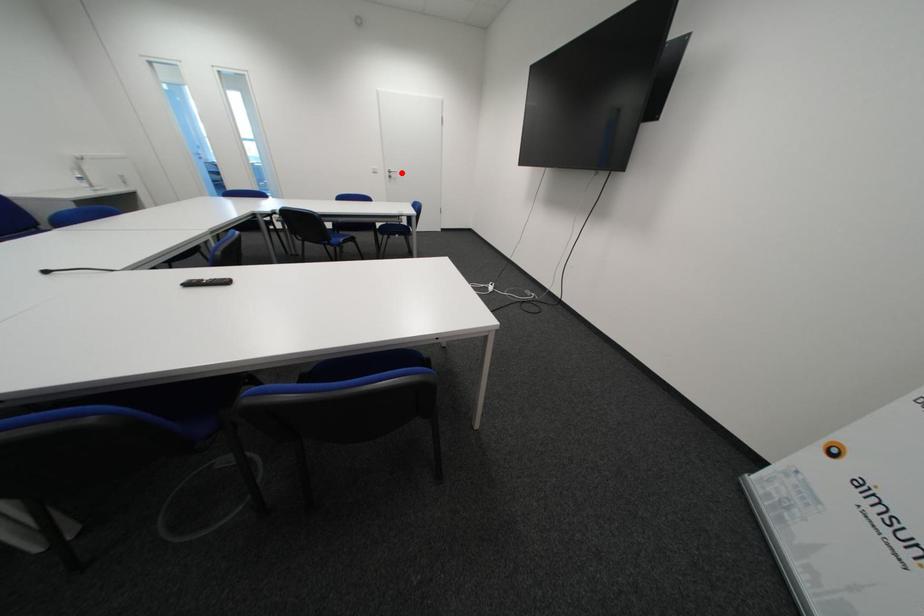
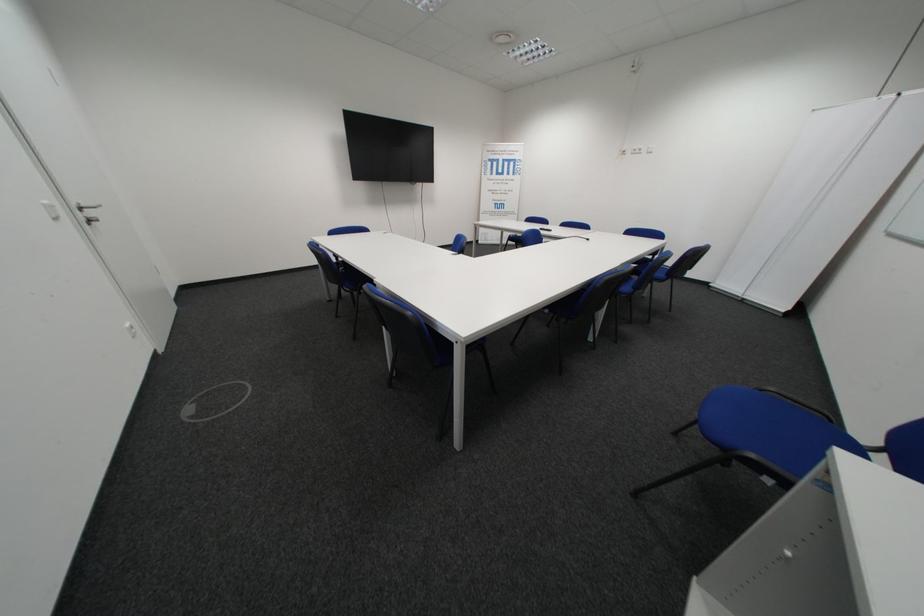
Locate, in the second image, the point that corresponds to the highlighted location in the first image.

(93, 209)